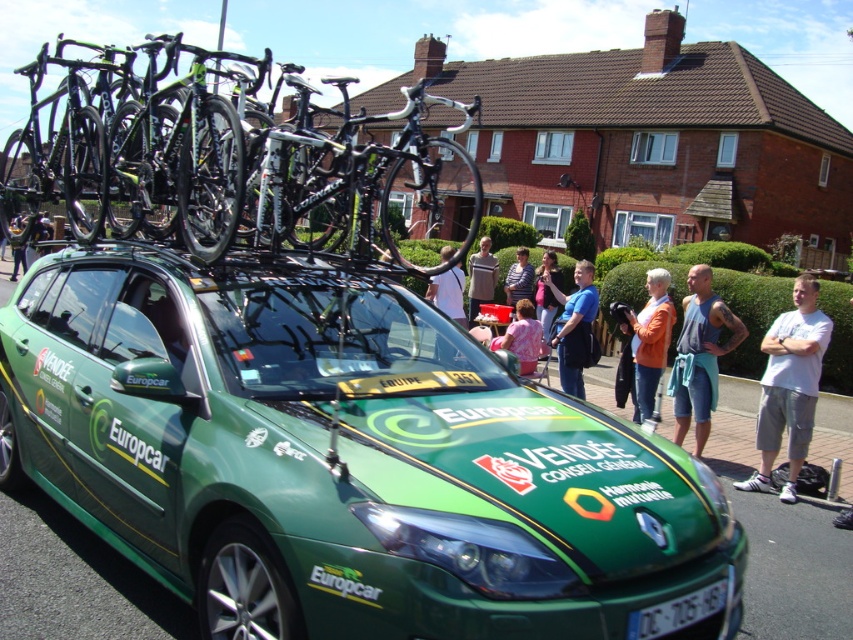
You are a photographer positioned at the edge of the scene. You need to capture a photo that includes both the striped cotton shirt at center and the matte black jacket at center. Given the distance between them, what is the minimum width of the camera lens you should use to ensure both are fully visible in the frame?

The striped cotton shirt at center is 95.76 centimeters from the matte black jacket at center. To capture both in the same frame, the camera lens should have a minimum width of at least 95.76 centimeters to accommodate the distance between them.

You are a photographer positioned at the back of the scene. You want to take a photo that includes both the blue fabric shorts at center and the striped shirt at center. Which object should you focus on first to ensure both are in clear view?

You should focus on the blue fabric shorts at center first because it is closer to the viewer than the striped shirt at center, ensuring both will be in focus when starting with the closer object.